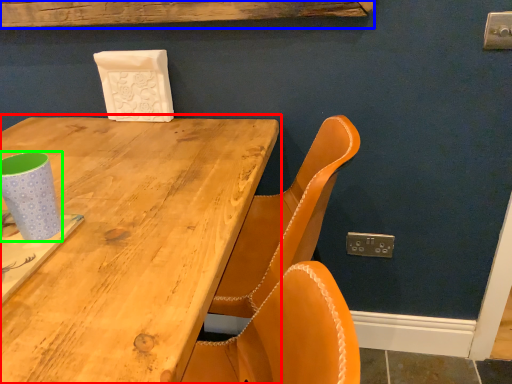
Question: Considering the real-world distances, which object is closest to table (highlighted by a red box)? plank (highlighted by a blue box) or paper cup (highlighted by a green box).

Choices:
 (A) plank
 (B) paper cup

Answer: (B)